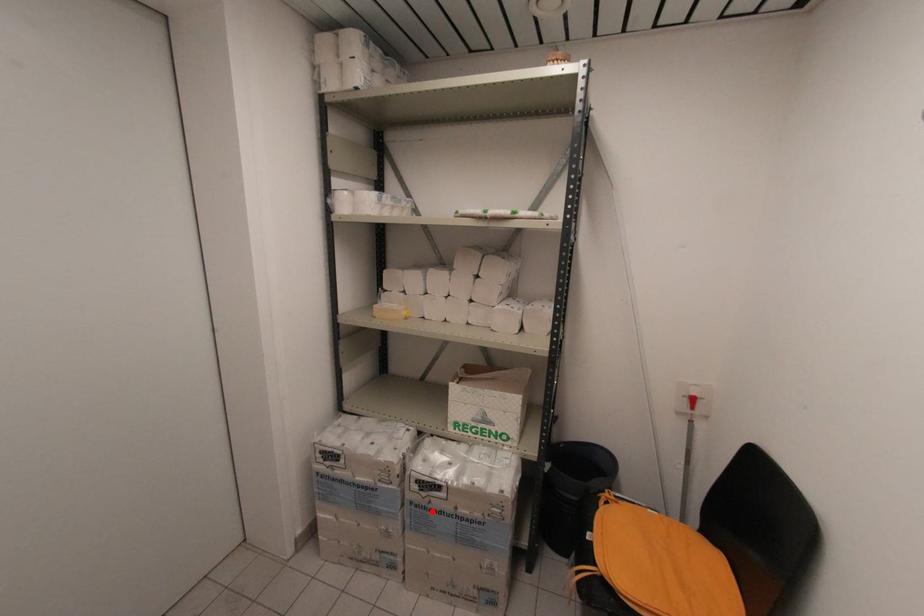
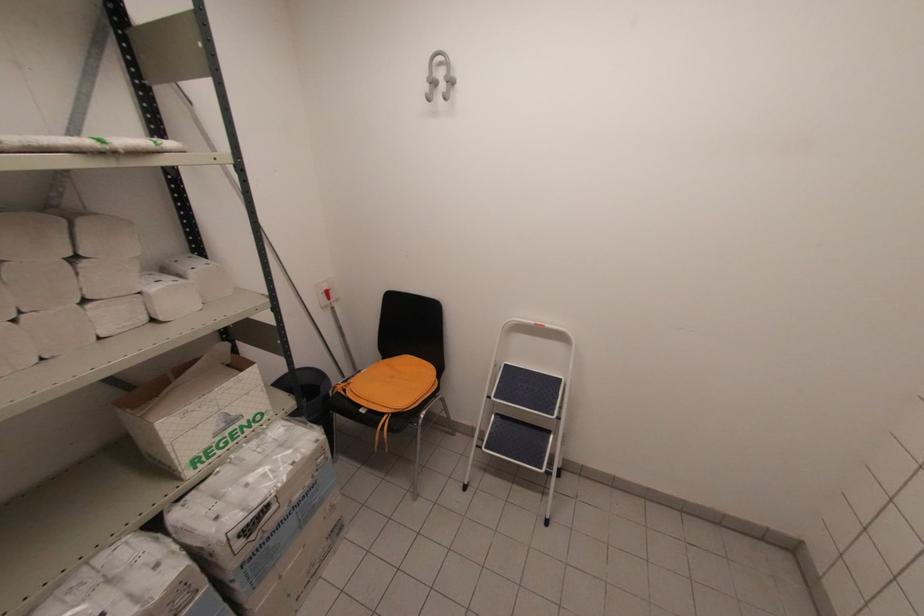
Question: I am providing you with two images of the same scene from different viewpoints. Image1 has a red point marked. In image2, the corresponding 3D location appears at what relative position? Reply with the corresponding letter.

Choices:
 (A) Closer
 (B) Farther

Answer: (A)